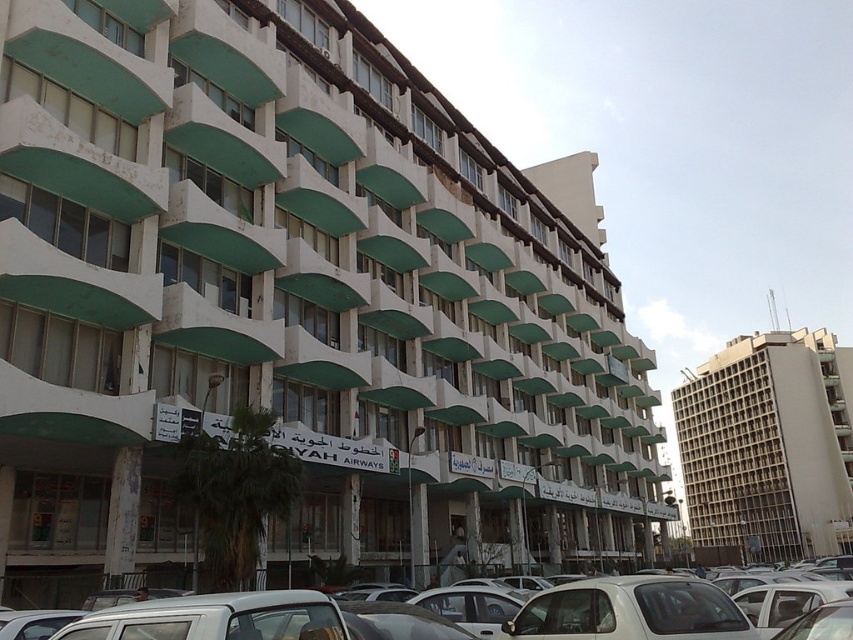
You are a delivery person trying to park your vehicle in the parking lot adjacent to the YAH Airways store. You have two white matte cars available for use. Which car, the white matte car at lower right or the white matte car at center, would be better suited for entering a low clearance garage entrance that requires vehicles to be under 1.5 meters in height?

The white matte car at lower right has a lesser height compared to the white matte car at center. Therefore, the white matte car at lower right would be better suited for entering the low clearance garage entrance as it meets the height requirement of under 1.5 meters.

You are standing at the entrance of YAH Airways and want to walk towards the point labeled as point (683, 605). There is an obstacle at point (711, 504). Will you encounter this obstacle before reaching your destination?

Point (711, 504) is behind point (683, 605), so you will not encounter the obstacle at point (711, 504) before reaching your destination point (683, 605).